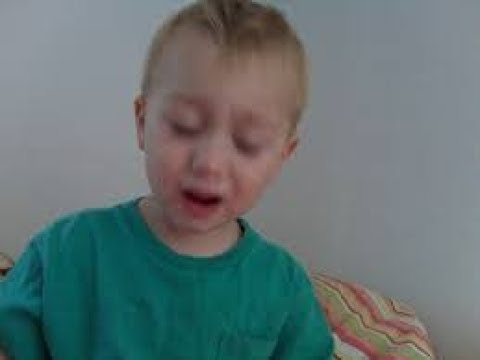
At what (x,y) coordinates should I click in order to perform the action: click on striped fabric. Please return your answer as a coordinate pair (x, y). Looking at the image, I should click on (375, 308).